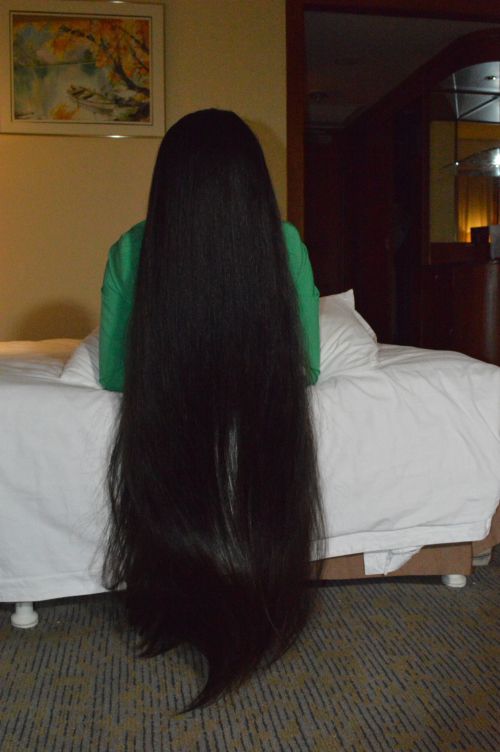
Image resolution: width=500 pixels, height=752 pixels. Find the location of `bed`. bed is located at coordinates (391, 398).